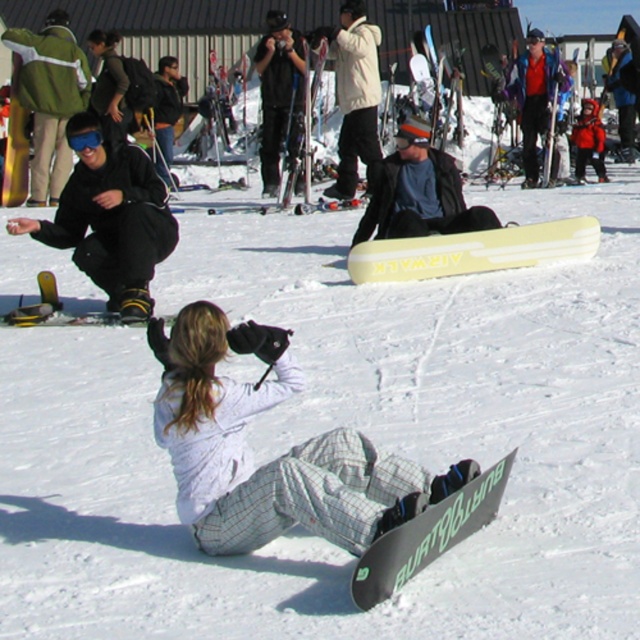
In the scene shown: You are a photographer trying to capture both the white matte snowboard at center and the yellow matte snowboard at center in one shot. Which snowboard would you need to adjust to ensure both are fully visible in the frame?

The white matte snowboard at center is positioned under the yellow matte snowboard at center, so you would need to adjust the yellow matte snowboard to ensure both are fully visible in the frame.

You are organizing a snowboard rental booth and need to fit both the matte black snowboard at left and the black matte snowboard at lower center into a rectangular storage rack. The rack has two slots with the same height but different widths. The left slot is 1.2 meters wide, and the right slot is 1.0 meters wide. Which snowboard should go into which slot to ensure they both fit properly?

The matte black snowboard at left, which is wider, should be placed in the left slot that is 1.2 meters wide, while the black matte snowboard at lower center, being narrower, should go into the right slot that is 1.0 meters wide. This arrangement ensures both snowboards fit appropriately based on their widths.

From the picture: You are planning to retrieve the matte black snowboard at left from its current position. Based on the coordinates provided in the scene description, can you determine its exact location relative to the other objects in the image?

The matte black snowboard at left is located at coordinates point (112, 225), which places it in the lower left portion of the image, closer to the edge. This position is distinct from the other objects like the person with the BURTON snowboard and the crouched individual with the AIRWALK snowboard, which are positioned further to the right and center areas.